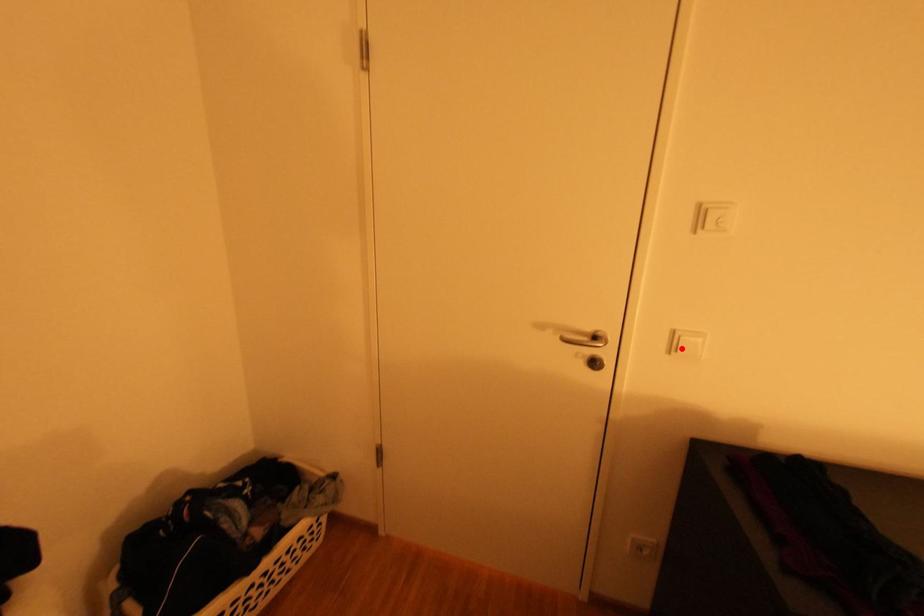
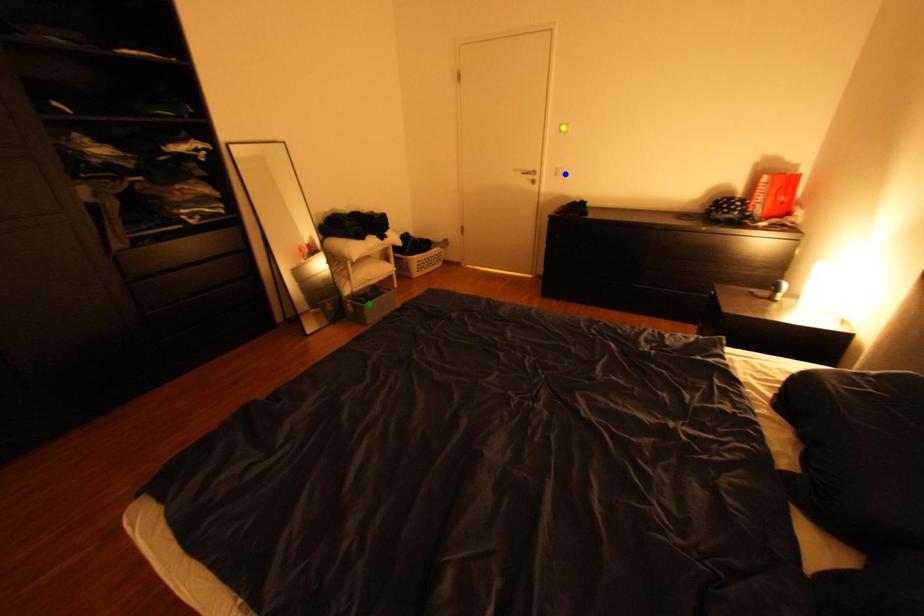
Question: I am providing you with two images of the same scene from different viewpoints. A red point is marked on the first image. You are given multiple points on the second image. Which mark in image 2 goes with the point in image 1?

Choices:
 (A) green point
 (B) yellow point
 (C) blue point

Answer: (C)